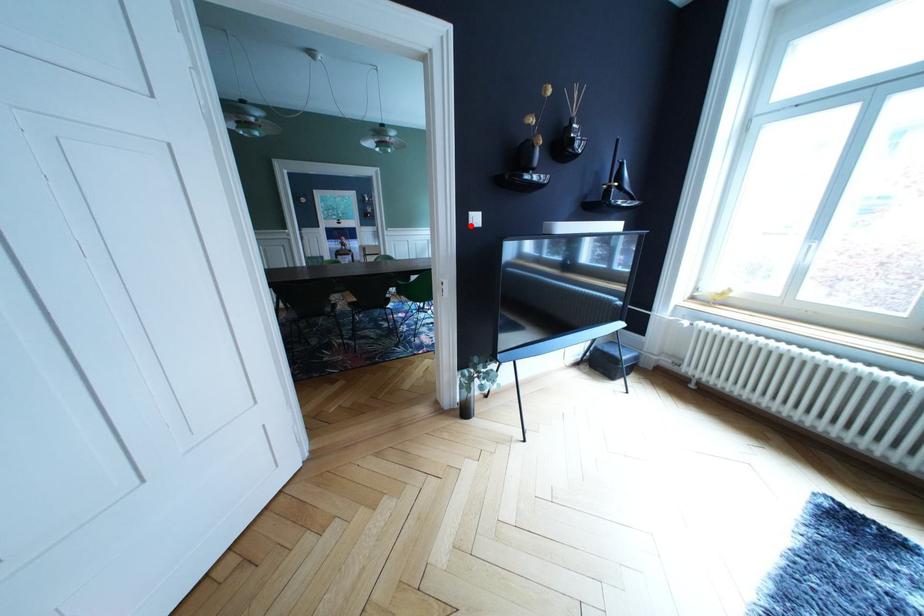
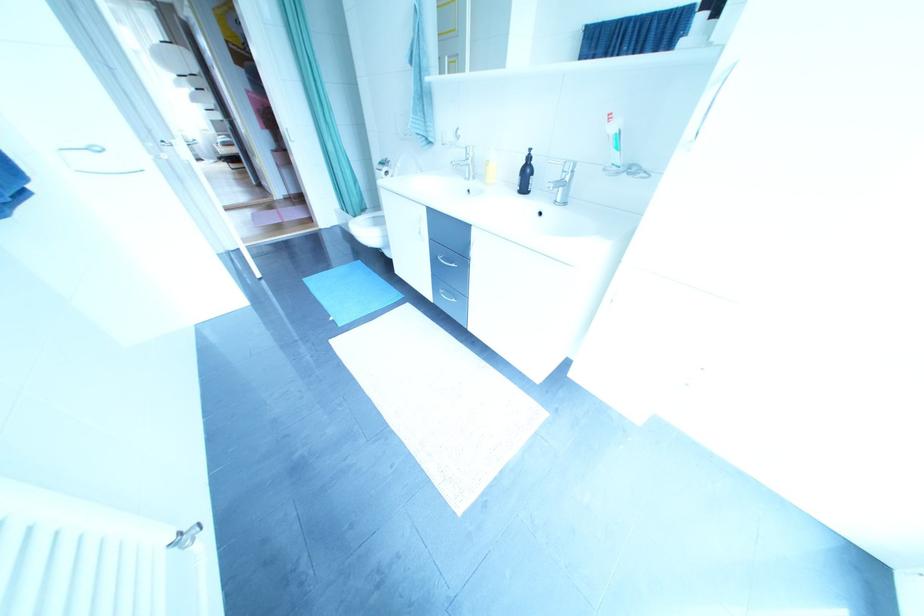
Question: I am providing you with two images of the same scene from different viewpoints. A red point is marked on the first image. At the location where the point appears in image 1, is it still visible in image 2?

Choices:
 (A) Yes
 (B) No

Answer: (B)